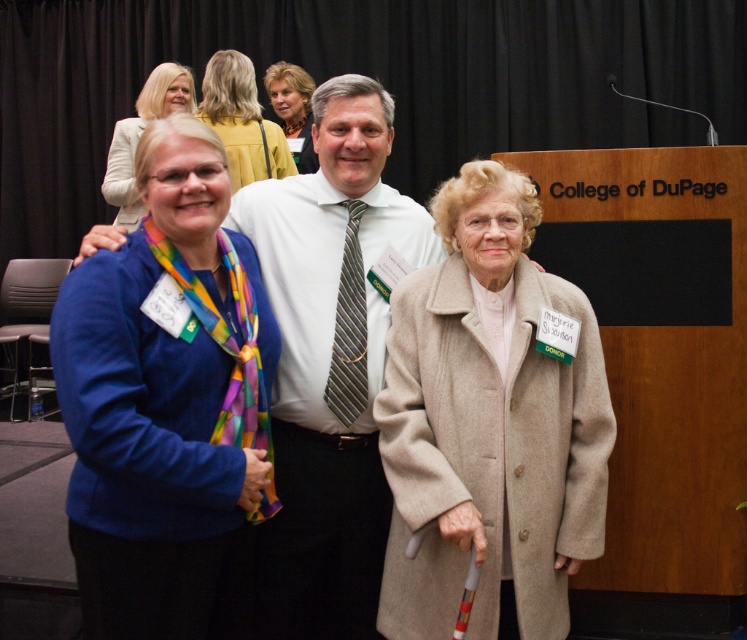
Question: Is beige wool coat at center wider than striped fabric tie at center?

Choices:
 (A) yes
 (B) no

Answer: (A)

Question: Can you confirm if white shirt at center is thinner than striped fabric tie at center?

Choices:
 (A) yes
 (B) no

Answer: (B)

Question: Considering the real-world distances, which object is farthest from the matte yellow blouse at upper center?

Choices:
 (A) beige wool coat at center
 (B) white shirt at center

Answer: (A)

Question: Considering the real-world distances, which object is closest to the matte yellow blouse at upper center?

Choices:
 (A) blue soft scarf at left
 (B) yellow fabric jacket at upper center
 (C) beige wool coat at center

Answer: (B)

Question: Does blue soft scarf at left appear on the left side of striped fabric tie at center?

Choices:
 (A) no
 (B) yes

Answer: (B)

Question: Which object is farther from the camera taking this photo?

Choices:
 (A) matte yellow blouse at upper center
 (B) beige wool coat at center

Answer: (A)